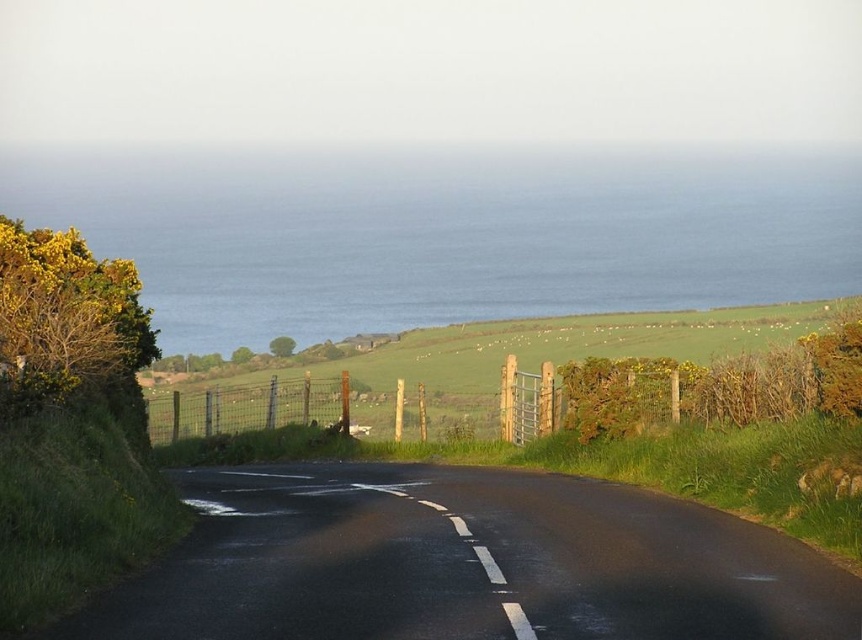
You are standing at the edge of the road and see the blue water at upper center and the green grassy hillside at center. Which object is positioned to the left of the other?

The blue water at upper center is positioned to the left of the green grassy hillside at center.

You are standing at the starting point of the road in the image. Which direction should you walk to reach the blue water at upper center located at point (x=448, y=236)?

The blue water at upper center is located at point (x=448, y=236), so you should walk forward along the road towards the upper center direction to reach it.